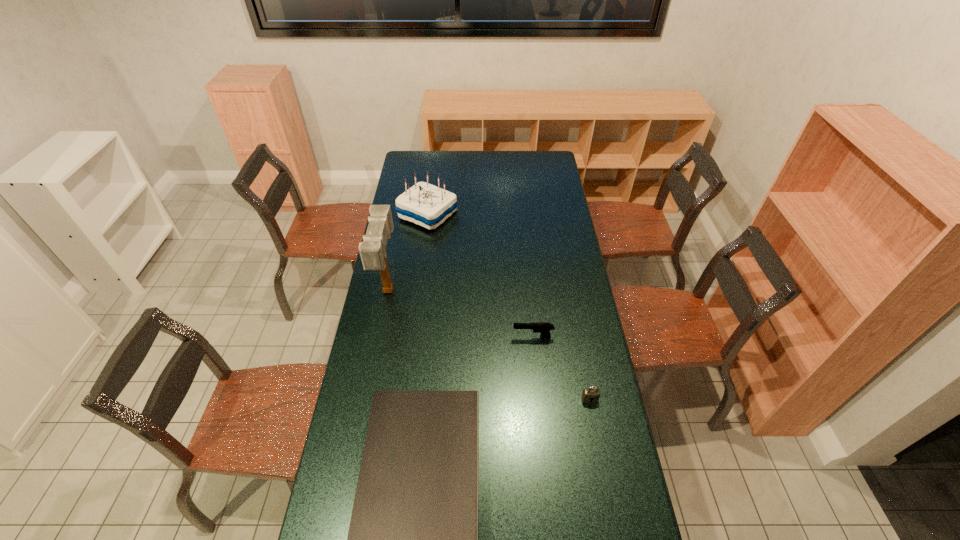
At what (x,y) coordinates should I click in order to perform the action: click on vacant space situated on the front-facing side of the second object from right to left. Please return your answer as a coordinate pair (x, y). Image resolution: width=960 pixels, height=540 pixels. Looking at the image, I should click on (446, 337).

Where is `free space located 0.300m on the front-facing side of the second object from right to left`? This screenshot has width=960, height=540. free space located 0.300m on the front-facing side of the second object from right to left is located at coordinates (436, 337).

Locate an element on the screen. vacant space positioned 0.070m on the front-facing side of the second object from right to left is located at coordinates (494, 337).

Identify the location of free space located at the front of the padlock near the keyhole. (601, 461).

This screenshot has width=960, height=540. I want to click on mallet that is positioned at the left edge, so click(x=372, y=250).

Locate an element on the screen. Image resolution: width=960 pixels, height=540 pixels. birthday cake that is at the left edge is located at coordinates (424, 204).

You are a GUI agent. You are given a task and a screenshot of the screen. Output one action in this format:
    pyautogui.click(x=<x>, y=<y>)
    Task: Click on the object that is at the right edge
    This screenshot has width=960, height=540.
    Given the screenshot: What is the action you would take?
    pyautogui.click(x=591, y=394)

Identify the location of free space at the far edge of the desktop. This screenshot has height=540, width=960. (483, 165).

This screenshot has height=540, width=960. Find the location of `vacant region at the left edge`. vacant region at the left edge is located at coordinates (369, 346).

Identify the location of blank area at the right edge. This screenshot has width=960, height=540. (542, 182).